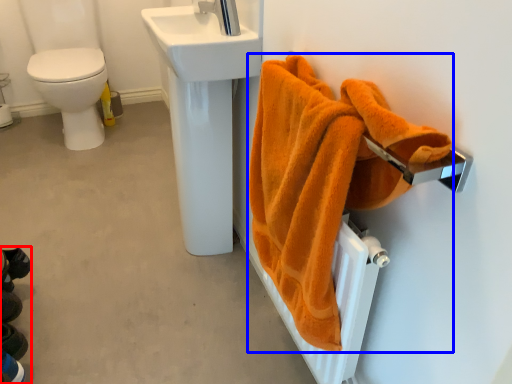
Question: Which object is further to the camera taking this photo, squat (highlighted by a red box) or towel (highlighted by a blue box)?

Choices:
 (A) squat
 (B) towel

Answer: (A)